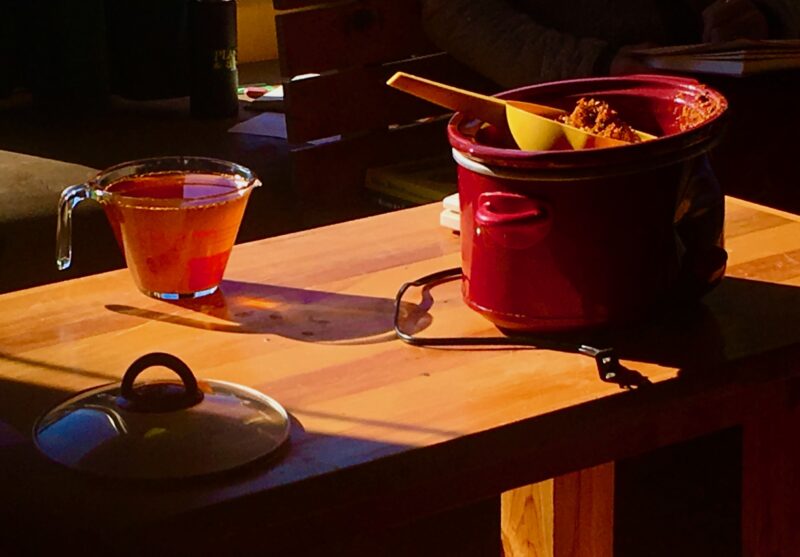
The height and width of the screenshot is (557, 800). I want to click on power cord, so click(x=608, y=359).